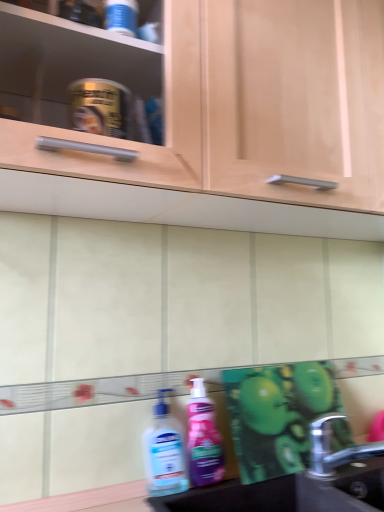
Question: Can you confirm if black matte sink at lower right is wider than matte wood cabinet at upper center?

Choices:
 (A) no
 (B) yes

Answer: (A)

Question: From a real-world perspective, is black matte sink at lower right over matte wood cabinet at upper center?

Choices:
 (A) yes
 (B) no

Answer: (B)

Question: Is black matte sink at lower right taller than matte wood cabinet at upper center?

Choices:
 (A) no
 (B) yes

Answer: (A)

Question: Is black matte sink at lower right next to matte wood cabinet at upper center and touching it?

Choices:
 (A) yes
 (B) no

Answer: (B)

Question: Does black matte sink at lower right lie in front of matte wood cabinet at upper center?

Choices:
 (A) no
 (B) yes

Answer: (A)

Question: In the image, is pink glossy lotion at lower center, which is counted as the second cleaning product, starting from the left, positioned in front of or behind translucent plastic hand sanitizer at lower center, arranged as the first cleaning product when viewed from the left?

Choices:
 (A) front
 (B) behind

Answer: (B)

Question: In the image, is pink glossy lotion at lower center, which is counted as the second cleaning product, starting from the left, on the left side or the right side of translucent plastic hand sanitizer at lower center, which ranks as the 2th cleaning product in right-to-left order?

Choices:
 (A) right
 (B) left

Answer: (A)

Question: Considering the positions of pink glossy lotion at lower center, marked as the first cleaning product in a right-to-left arrangement, and translucent plastic hand sanitizer at lower center, which ranks as the 2th cleaning product in right-to-left order, in the image, is pink glossy lotion at lower center, marked as the first cleaning product in a right-to-left arrangement, bigger or smaller than translucent plastic hand sanitizer at lower center, which ranks as the 2th cleaning product in right-to-left order,?

Choices:
 (A) big
 (B) small

Answer: (B)

Question: From the image's perspective, is pink glossy lotion at lower center, which is counted as the second cleaning product, starting from the left, above or below translucent plastic hand sanitizer at lower center, which ranks as the 2th cleaning product in right-to-left order?

Choices:
 (A) above
 (B) below

Answer: (A)

Question: In terms of size, does matte wood cabinet at upper center appear bigger or smaller than translucent plastic hand sanitizer at lower center, which ranks as the 2th cleaning product in right-to-left order?

Choices:
 (A) big
 (B) small

Answer: (A)

Question: Relative to translucent plastic hand sanitizer at lower center, which ranks as the 2th cleaning product in right-to-left order, is matte wood cabinet at upper center in front or behind?

Choices:
 (A) behind
 (B) front

Answer: (B)

Question: Is matte wood cabinet at upper center inside or outside of translucent plastic hand sanitizer at lower center, arranged as the first cleaning product when viewed from the left?

Choices:
 (A) inside
 (B) outside

Answer: (B)

Question: Considering the positions of point [x=261, y=57] and point [x=160, y=423], is point [x=261, y=57] closer or farther from the camera than point [x=160, y=423]?

Choices:
 (A) closer
 (B) farther

Answer: (A)

Question: In terms of width, does matte wood cabinet at upper center look wider or thinner when compared to pink glossy lotion at lower center, marked as the first cleaning product in a right-to-left arrangement?

Choices:
 (A) wide
 (B) thin

Answer: (A)

Question: Does point (228, 147) appear closer or farther from the camera than point (221, 479)?

Choices:
 (A) closer
 (B) farther

Answer: (A)